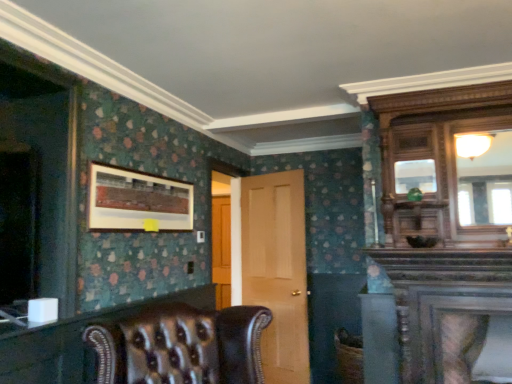
Locate an element on the screen. Image resolution: width=512 pixels, height=384 pixels. leather at lower left, which ranks as the second dresser in right-to-left order is located at coordinates (75, 342).

The width and height of the screenshot is (512, 384). Find the location of `wooden carved dresser at upper right, marked as the 1th dresser in a right-to-left arrangement`. wooden carved dresser at upper right, marked as the 1th dresser in a right-to-left arrangement is located at coordinates (446, 224).

Image resolution: width=512 pixels, height=384 pixels. Describe the element at coordinates (181, 346) in the screenshot. I see `leather armchair at center` at that location.

What is the approximate width of wooden-framed artwork at upper left?

It is 2.00 inches.

Locate an element on the screen. This screenshot has height=384, width=512. leather at lower left, the 1th dresser positioned from the left is located at coordinates pos(75,342).

Considering the positions of objects leather at lower left, the 1th dresser positioned from the left, and wooden carved dresser at upper right, which is the first dresser from top to bottom, in the image provided, who is more to the right, leather at lower left, the 1th dresser positioned from the left, or wooden carved dresser at upper right, which is the first dresser from top to bottom,?

Positioned to the right is wooden carved dresser at upper right, which is the first dresser from top to bottom.

Is point (51, 326) closer to viewer compared to point (460, 290)?

That is True.

Locate an element on the screen. This screenshot has height=384, width=512. dresser that is in front of the wooden carved dresser at upper right, marked as the 1th dresser in a right-to-left arrangement is located at coordinates (75, 342).

In the scene shown: Does wooden-framed artwork at upper left lie behind leather armchair at center?

That is True.

Considering the points (117, 197) and (215, 350), which point is in front, point (117, 197) or point (215, 350)?

The point (215, 350) is in front.

From the image's perspective, which object appears higher, wooden-framed artwork at upper left or leather armchair at center?

wooden-framed artwork at upper left is shown above in the image.

From a real-world perspective, is wooden carved dresser at upper right, marked as the 2th dresser in a bottom-to-top arrangement, above or below light brown wood door at center?

wooden carved dresser at upper right, marked as the 2th dresser in a bottom-to-top arrangement, is above light brown wood door at center.

Between wooden carved dresser at upper right, marked as the 2th dresser in a bottom-to-top arrangement, and light brown wood door at center, which one has less height?

With less height is wooden carved dresser at upper right, marked as the 2th dresser in a bottom-to-top arrangement.

Is wooden carved dresser at upper right, marked as the 1th dresser in a right-to-left arrangement, wider or thinner than light brown wood door at center?

Clearly, wooden carved dresser at upper right, marked as the 1th dresser in a right-to-left arrangement, has more width compared to light brown wood door at center.

Which object is closer to the camera, wooden-framed artwork at upper left or leather at lower left, the 1th dresser positioned from the left?

leather at lower left, the 1th dresser positioned from the left, is in front.

How many degrees apart are the facing directions of wooden-framed artwork at upper left and leather at lower left, acting as the second dresser starting from the top?

0.932 degrees.

Is wooden-framed artwork at upper left inside or outside of leather at lower left, acting as the second dresser starting from the top?

wooden-framed artwork at upper left exists outside the volume of leather at lower left, acting as the second dresser starting from the top.

Is light brown wood door at center surrounding leather at lower left, which ranks as the second dresser in right-to-left order?

Actually, leather at lower left, which ranks as the second dresser in right-to-left order, is outside light brown wood door at center.

You are a GUI agent. You are given a task and a screenshot of the screen. Output one action in this format:
    pyautogui.click(x=<x>, y=<y>)
    Task: Click on the door located on the right of leather at lower left, the 1th dresser positioned from the left
    This screenshot has width=512, height=384.
    Given the screenshot: What is the action you would take?
    pyautogui.click(x=273, y=268)

Is light brown wood door at center aimed at leather at lower left, which is counted as the first dresser, starting from the bottom?

Yes.

Is point (278, 203) positioned in front of point (206, 308)?

No, it is behind (206, 308).

From a real-world perspective, is wooden-framed artwork at upper left physically above wooden carved dresser at upper right, marked as the 1th dresser in a right-to-left arrangement?

No, from a real-world perspective, wooden-framed artwork at upper left is not over wooden carved dresser at upper right, marked as the 1th dresser in a right-to-left arrangement

Considering the sizes of wooden-framed artwork at upper left and wooden carved dresser at upper right, marked as the 2th dresser in a bottom-to-top arrangement, in the image, is wooden-framed artwork at upper left bigger or smaller than wooden carved dresser at upper right, marked as the 2th dresser in a bottom-to-top arrangement,?

Clearly, wooden-framed artwork at upper left is smaller in size than wooden carved dresser at upper right, marked as the 2th dresser in a bottom-to-top arrangement.

Considering the positions of objects wooden-framed artwork at upper left and wooden carved dresser at upper right, marked as the 2th dresser in a bottom-to-top arrangement, in the image provided, who is more to the left, wooden-framed artwork at upper left or wooden carved dresser at upper right, marked as the 2th dresser in a bottom-to-top arrangement,?

wooden-framed artwork at upper left is more to the left.

Is point (139, 209) positioned after point (479, 189)?

That is False.

Considering the sizes of objects light brown wood door at center and wooden-framed artwork at upper left in the image provided, who is taller, light brown wood door at center or wooden-framed artwork at upper left?

light brown wood door at center is taller.

Considering the positions of objects light brown wood door at center and wooden-framed artwork at upper left in the image provided, who is behind, light brown wood door at center or wooden-framed artwork at upper left?

light brown wood door at center is further from the camera.

Do you think light brown wood door at center is within wooden-framed artwork at upper left, or outside of it?

light brown wood door at center cannot be found inside wooden-framed artwork at upper left.

Based on their sizes in the image, would you say light brown wood door at center is bigger or smaller than wooden-framed artwork at upper left?

Clearly, light brown wood door at center is larger in size than wooden-framed artwork at upper left.

Locate an element on the screen. Image resolution: width=512 pixels, height=384 pixels. dresser located behind the leather at lower left, which is counted as the first dresser, starting from the bottom is located at coordinates (446, 224).

Locate an element on the screen. The image size is (512, 384). picture frame above the leather armchair at center (from the image's perspective) is located at coordinates (138, 201).

Based on their spatial positions, is leather at lower left, which ranks as the second dresser in right-to-left order, or leather armchair at center further from wooden carved dresser at upper right, marked as the 1th dresser in a right-to-left arrangement?

leather at lower left, which ranks as the second dresser in right-to-left order.

In the scene shown: When comparing their distances from wooden carved dresser at upper right, placed as the second dresser when sorted from left to right, does wooden-framed artwork at upper left or light brown wood door at center seem closer?

Based on the image, light brown wood door at center appears to be nearer to wooden carved dresser at upper right, placed as the second dresser when sorted from left to right.

From the image, which object appears to be nearer to leather at lower left, which ranks as the second dresser in right-to-left order, wooden carved dresser at upper right, placed as the second dresser when sorted from left to right, or light brown wood door at center?

light brown wood door at center is closer to leather at lower left, which ranks as the second dresser in right-to-left order.

Looking at this image, estimate the real-world distances between objects in this image. Which object is closer to leather armchair at center, leather at lower left, acting as the second dresser starting from the top, or wooden carved dresser at upper right, which is the first dresser from top to bottom?

Among the two, leather at lower left, acting as the second dresser starting from the top, is located nearer to leather armchair at center.

Considering their positions, is light brown wood door at center positioned further to leather armchair at center than wooden carved dresser at upper right, marked as the 1th dresser in a right-to-left arrangement?

light brown wood door at center lies further to leather armchair at center than the other object.

Estimate the real-world distances between objects in this image. Which object is further from leather armchair at center, leather at lower left, which ranks as the second dresser in right-to-left order, or light brown wood door at center?

light brown wood door at center.

From the image, which object appears to be farther from leather armchair at center, wooden-framed artwork at upper left or leather at lower left, the 1th dresser positioned from the left?

wooden-framed artwork at upper left is further to leather armchair at center.

From the image, which object appears to be farther from light brown wood door at center, wooden carved dresser at upper right, which is the first dresser from top to bottom, or leather at lower left, which is counted as the first dresser, starting from the bottom?

Based on the image, wooden carved dresser at upper right, which is the first dresser from top to bottom, appears to be further to light brown wood door at center.

Image resolution: width=512 pixels, height=384 pixels. I want to click on dresser positioned between leather at lower left, acting as the second dresser starting from the top, and light brown wood door at center from near to far, so click(x=446, y=224).

Where is `picture frame located between leather at lower left, which ranks as the second dresser in right-to-left order, and wooden carved dresser at upper right, placed as the second dresser when sorted from left to right, in the left-right direction`? picture frame located between leather at lower left, which ranks as the second dresser in right-to-left order, and wooden carved dresser at upper right, placed as the second dresser when sorted from left to right, in the left-right direction is located at coordinates (138, 201).

The width and height of the screenshot is (512, 384). What are the coordinates of `picture frame between leather armchair at center and light brown wood door at center from front to back` in the screenshot? It's located at (138, 201).

Where is `chair between leather at lower left, which ranks as the second dresser in right-to-left order, and wooden carved dresser at upper right, placed as the second dresser when sorted from left to right`? The height and width of the screenshot is (384, 512). chair between leather at lower left, which ranks as the second dresser in right-to-left order, and wooden carved dresser at upper right, placed as the second dresser when sorted from left to right is located at coordinates (181, 346).